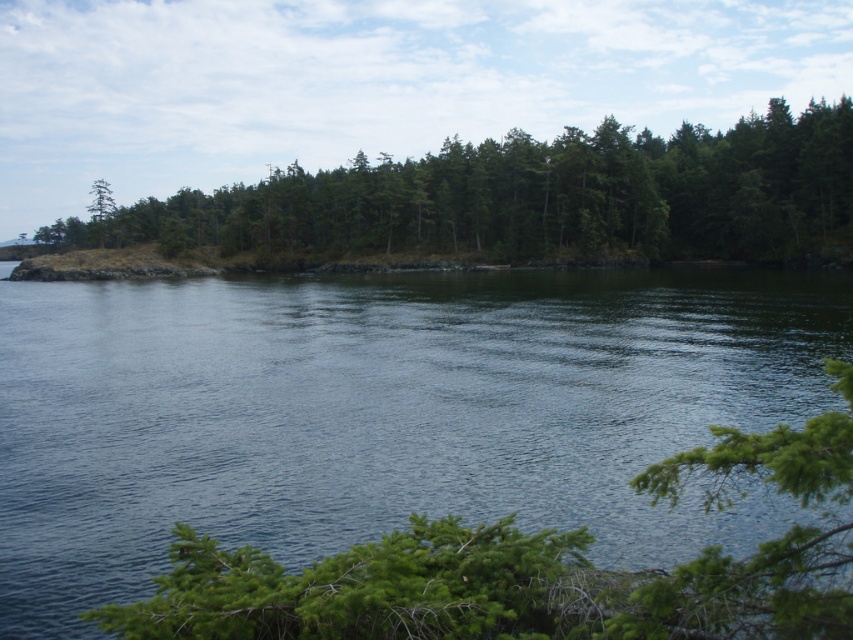
You are an environmental scientist assessing the health of this ecosystem. You observe the blue water at center and the green textured trees at center. Which object occupies a larger area in the image?

The green textured trees at center occupy a larger area in the image than the blue water at center.

You are standing at the edge of the landscape and want to cross from one side to the other. Given that the blue water at center is narrower than the green textured trees at center, which path would allow you to cross without getting wet?

The green textured trees at center are wider than the blue water at center, so crossing through the green textured trees at center would keep you dry as it spans a greater width.